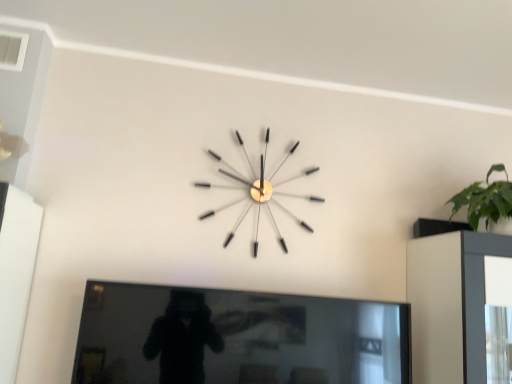
What do you see at coordinates (237, 337) in the screenshot?
I see `black glossy tv at center` at bounding box center [237, 337].

Find the location of a particular element. black glossy tv at center is located at coordinates (237, 337).

You are a GUI agent. You are given a task and a screenshot of the screen. Output one action in this format:
    pyautogui.click(x=<x>, y=<y>)
    Task: Click on the clear acrylic clock at center
    
    Given the screenshot: What is the action you would take?
    pyautogui.click(x=260, y=193)

Describe the element at coordinates (260, 193) in the screenshot. I see `clear acrylic clock at center` at that location.

The image size is (512, 384). I want to click on black glossy tv at center, so click(x=237, y=337).

Visually, is black glossy tv at center positioned to the left or to the right of clear acrylic clock at center?

black glossy tv at center is positioned on clear acrylic clock at center's left side.

Is black glossy tv at center in front of or behind clear acrylic clock at center in the image?

black glossy tv at center is in front of clear acrylic clock at center.

Does point (258, 315) come farther from viewer compared to point (271, 219)?

No, it is not.

From the image's perspective, which object appears higher, black glossy tv at center or clear acrylic clock at center?

From the image's view, clear acrylic clock at center is above.

From a real-world perspective, is black glossy tv at center physically located above or below clear acrylic clock at center?

Clearly, from a real-world perspective, black glossy tv at center is below clear acrylic clock at center.

Is black glossy tv at center thinner than clear acrylic clock at center?

No.

Considering the sizes of objects black glossy tv at center and clear acrylic clock at center in the image provided, who is shorter, black glossy tv at center or clear acrylic clock at center?

black glossy tv at center.

Is black glossy tv at center bigger than clear acrylic clock at center?

Correct, black glossy tv at center is larger in size than clear acrylic clock at center.

Is clear acrylic clock at center located within black glossy tv at center?

No, clear acrylic clock at center is not surrounded by black glossy tv at center.

Are black glossy tv at center and clear acrylic clock at center beside each other?

There is a gap between black glossy tv at center and clear acrylic clock at center.

Based on the photo, is black glossy tv at center oriented away from clear acrylic clock at center?

No.

This screenshot has width=512, height=384. Identify the location of wall clock on the right of black glossy tv at center. coord(260,193).

Is clear acrylic clock at center at the left side of black glossy tv at center?

No, clear acrylic clock at center is not to the left of black glossy tv at center.

Considering the relative positions of clear acrylic clock at center and black glossy tv at center in the image provided, is clear acrylic clock at center behind black glossy tv at center?

Yes, clear acrylic clock at center is further from the viewer.

Considering the points (248, 181) and (388, 322), which point is behind, point (248, 181) or point (388, 322)?

Point (248, 181)

From the image's perspective, is clear acrylic clock at center on top of black glossy tv at center?

Yes.

From a real-world perspective, is clear acrylic clock at center positioned above or below black glossy tv at center?

In terms of real-world spatial position, clear acrylic clock at center is above black glossy tv at center.

In terms of width, does clear acrylic clock at center look wider or thinner when compared to black glossy tv at center?

In the image, clear acrylic clock at center appears to be more narrow than black glossy tv at center.

Which of these two, clear acrylic clock at center or black glossy tv at center, stands shorter?

Standing shorter between the two is black glossy tv at center.

Who is smaller, clear acrylic clock at center or black glossy tv at center?

Smaller between the two is clear acrylic clock at center.

Is clear acrylic clock at center outside of black glossy tv at center?

Yes, clear acrylic clock at center is located beyond the bounds of black glossy tv at center.

Are clear acrylic clock at center and black glossy tv at center located far from each other?

No, there isn't a large distance between clear acrylic clock at center and black glossy tv at center.

Is clear acrylic clock at center oriented towards black glossy tv at center?

No, clear acrylic clock at center is not aimed at black glossy tv at center.

Measure the distance from clear acrylic clock at center to black glossy tv at center.

18.54 inches.

Identify the location of wall clock above the black glossy tv at center (from the image's perspective). This screenshot has height=384, width=512. (260, 193).

You are a GUI agent. You are given a task and a screenshot of the screen. Output one action in this format:
    pyautogui.click(x=<x>, y=<y>)
    Task: Click on the wall clock that appears above the black glossy tv at center (from a real-world perspective)
    The image size is (512, 384).
    Given the screenshot: What is the action you would take?
    pyautogui.click(x=260, y=193)

Find the location of a particular element. This screenshot has height=384, width=512. picture frame in front of the clear acrylic clock at center is located at coordinates (237, 337).